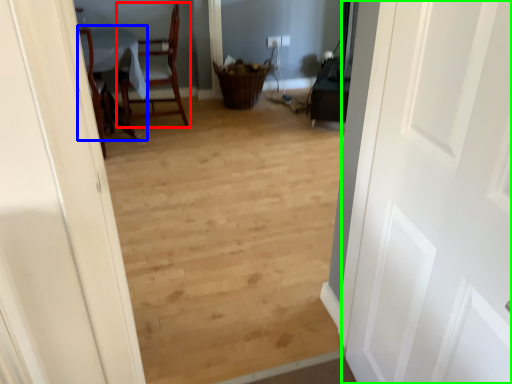
Question: Based on their relative distances, which object is farther from chair (highlighted by a red box)? Choose from table (highlighted by a blue box) and door (highlighted by a green box).

Choices:
 (A) table
 (B) door

Answer: (B)